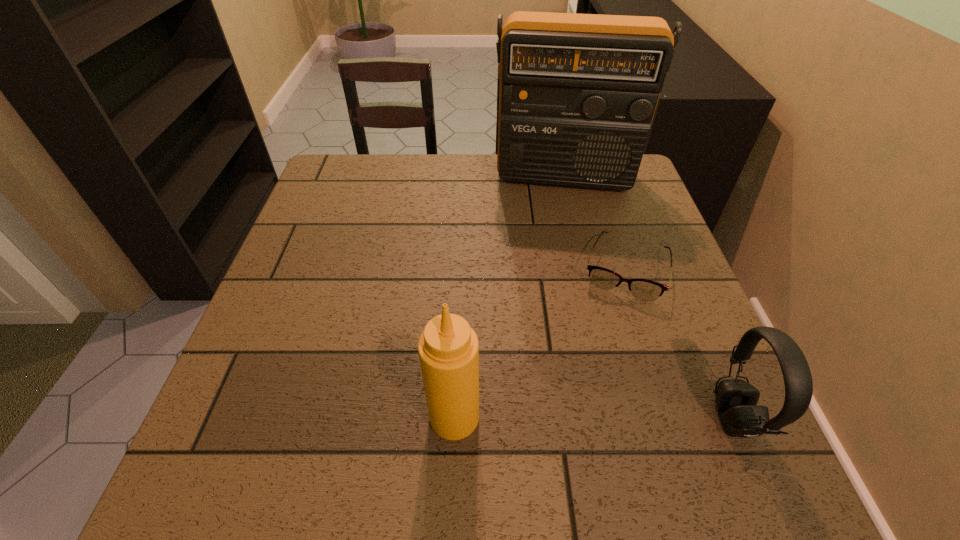
I want to click on condiment, so click(x=448, y=348).

Locate an element on the screen. Image resolution: width=960 pixels, height=540 pixels. the leftmost object is located at coordinates (448, 348).

Locate an element on the screen. This screenshot has height=540, width=960. the third tallest object is located at coordinates (736, 400).

Locate an element on the screen. This screenshot has width=960, height=540. the shortest object is located at coordinates (643, 289).

Identify the location of the second farthest object. The height and width of the screenshot is (540, 960). (643, 289).

Identify the location of the tallest object. The width and height of the screenshot is (960, 540). (577, 95).

Locate an element on the screen. radio receiver is located at coordinates click(x=577, y=95).

The image size is (960, 540). What are the coordinates of `blank space located on the back of the condiment` in the screenshot? It's located at (457, 361).

Locate an element on the screen. This screenshot has height=540, width=960. free space located 0.140m on the front-facing side of the third tallest object is located at coordinates (634, 417).

At what (x,y) coordinates should I click in order to perform the action: click on free space located on the front-facing side of the third tallest object. Please return your answer as a coordinate pair (x, y). The image size is (960, 540). Looking at the image, I should click on (663, 417).